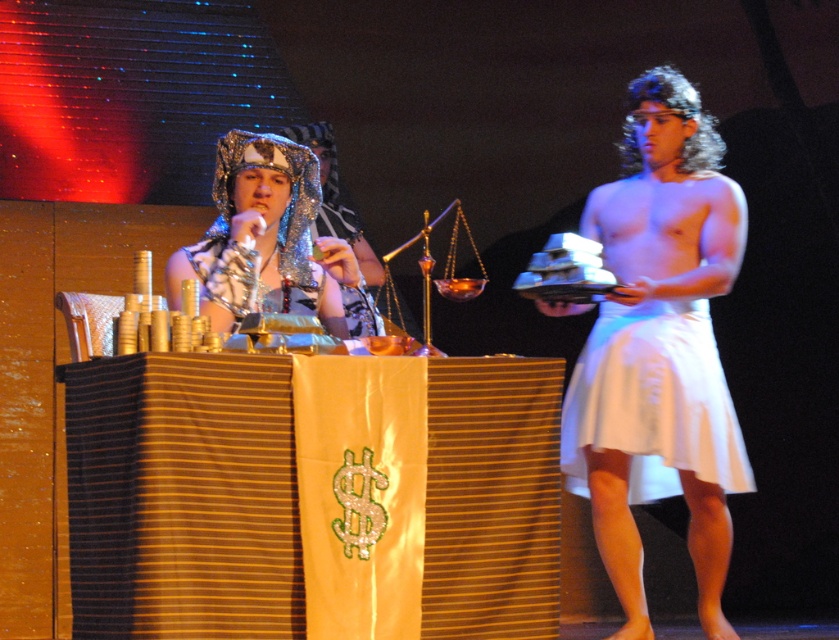
Question: Which of these objects is positioned farthest from the shiny silver headscarf at center?

Choices:
 (A) white cotton skirt at center
 (B) white clothed person at right

Answer: (A)

Question: Based on their relative distances, which object is nearer to the white clothed person at right?

Choices:
 (A) white cotton skirt at center
 (B) shiny silver headscarf at center

Answer: (A)

Question: Does white cotton skirt at center appear on the right side of shiny silver headscarf at center?

Choices:
 (A) no
 (B) yes

Answer: (B)

Question: Is white clothed person at right wider than shiny silver headscarf at center?

Choices:
 (A) no
 (B) yes

Answer: (B)

Question: Estimate the real-world distances between objects in this image. Which object is closer to the white cotton skirt at center?

Choices:
 (A) shiny silver headscarf at center
 (B) white clothed person at right

Answer: (B)

Question: Is white clothed person at right smaller than white cotton skirt at center?

Choices:
 (A) no
 (B) yes

Answer: (A)